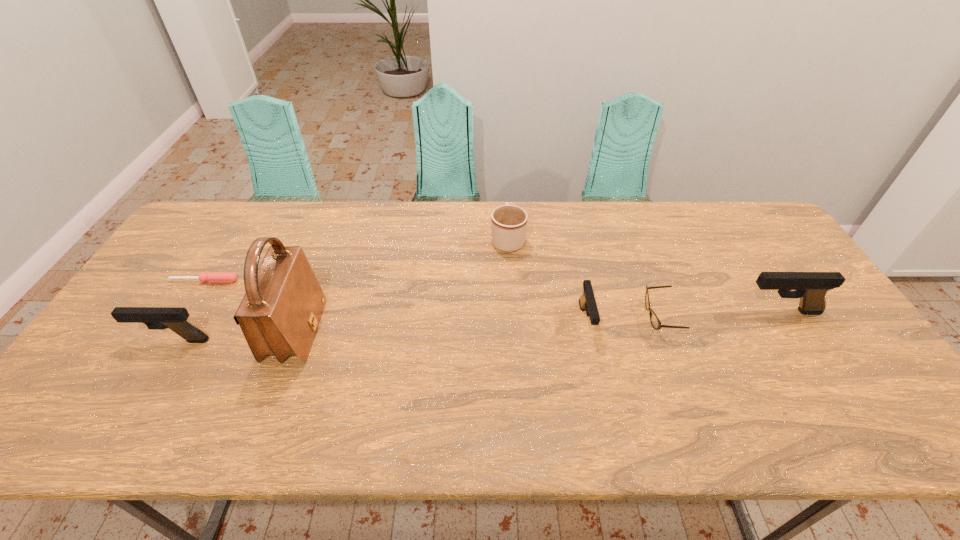
Identify the location of blank region between the screwdriver and the leftmost pistol. The height and width of the screenshot is (540, 960). (188, 310).

Find the location of `blank region between the farthest object and the second tallest pistol`. blank region between the farthest object and the second tallest pistol is located at coordinates (340, 289).

At what (x,y) coordinates should I click in order to perform the action: click on free area in between the sixth shortest object and the second shortest object. Please return your answer as a coordinate pair (x, y). The width and height of the screenshot is (960, 540). Looking at the image, I should click on [x=720, y=314].

Where is `empty space between the sixth shortest object and the spectacles`? empty space between the sixth shortest object and the spectacles is located at coordinates click(x=720, y=314).

Where is `free space between the farthest object and the tallest object`? free space between the farthest object and the tallest object is located at coordinates (402, 286).

In order to click on object that is the third nearest to the leftmost pistol in this screenshot , I will do `click(508, 222)`.

Image resolution: width=960 pixels, height=540 pixels. Identify the location of the second closest object to the leftmost pistol. (213, 277).

Locate an element on the screen. The width and height of the screenshot is (960, 540). the closest pistol to the rightmost pistol is located at coordinates (587, 302).

Locate an element on the screen. the second closest pistol to the rightmost object is located at coordinates (157, 318).

Where is `vacant space that satisfies the following two spatial constraints: 1. on the front-facing side of the shortest pistol; 2. on the front-facing side of the second tallest pistol`? The image size is (960, 540). vacant space that satisfies the following two spatial constraints: 1. on the front-facing side of the shortest pistol; 2. on the front-facing side of the second tallest pistol is located at coordinates (589, 340).